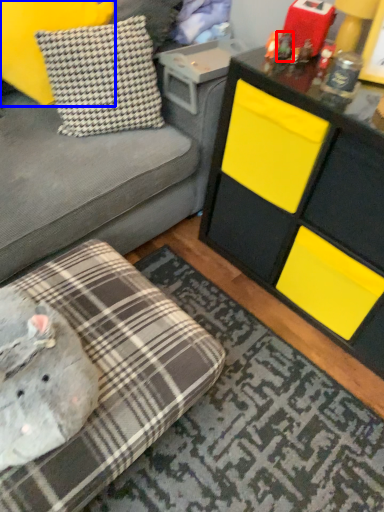
Question: Which object is further to the camera taking this photo, toy (highlighted by a red box) or pillow (highlighted by a blue box)?

Choices:
 (A) toy
 (B) pillow

Answer: (A)